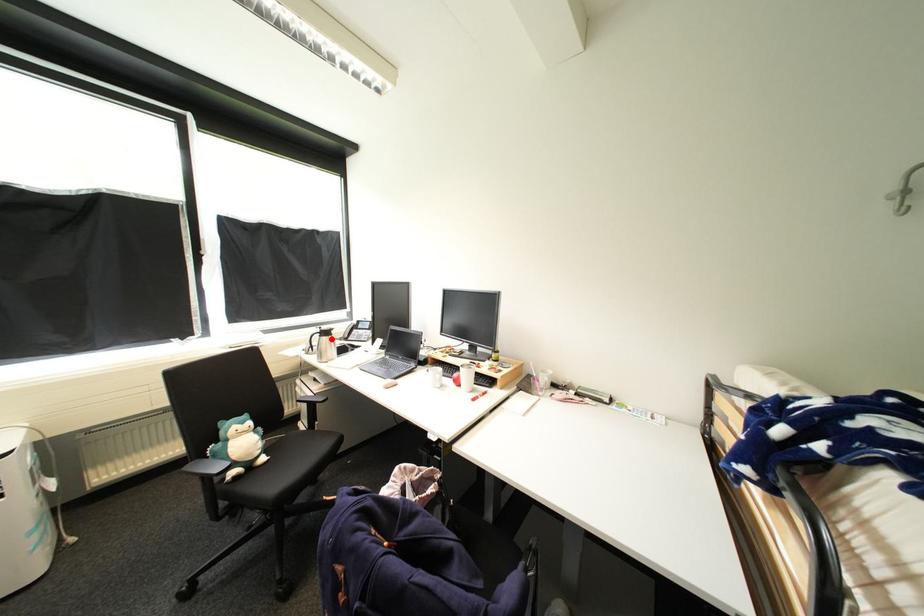
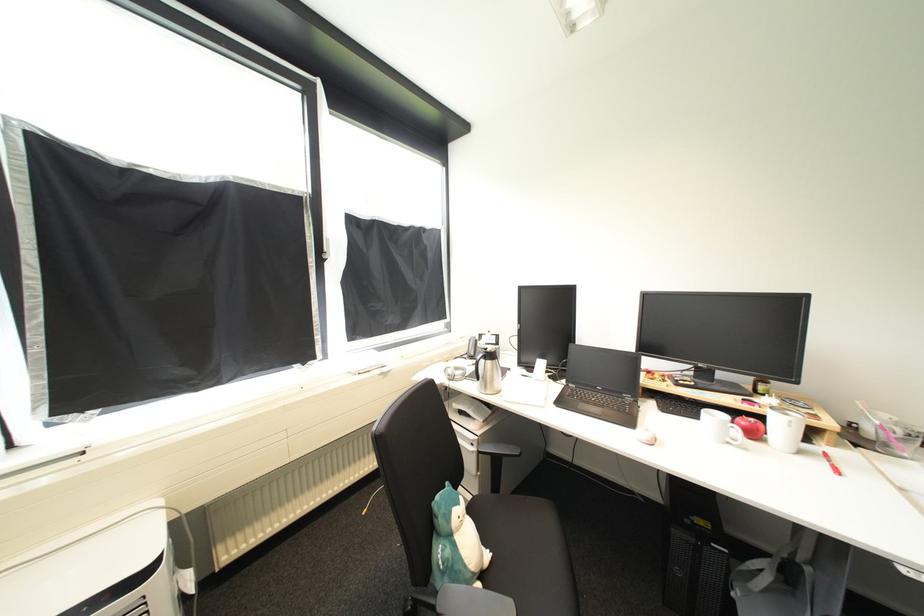
Question: I am providing you with two images of the same scene from different viewpoints. A red point is shown in image1. For the corresponding object point in image2, is it positioned nearer or farther from the camera?

Choices:
 (A) Nearer
 (B) Farther

Answer: (B)